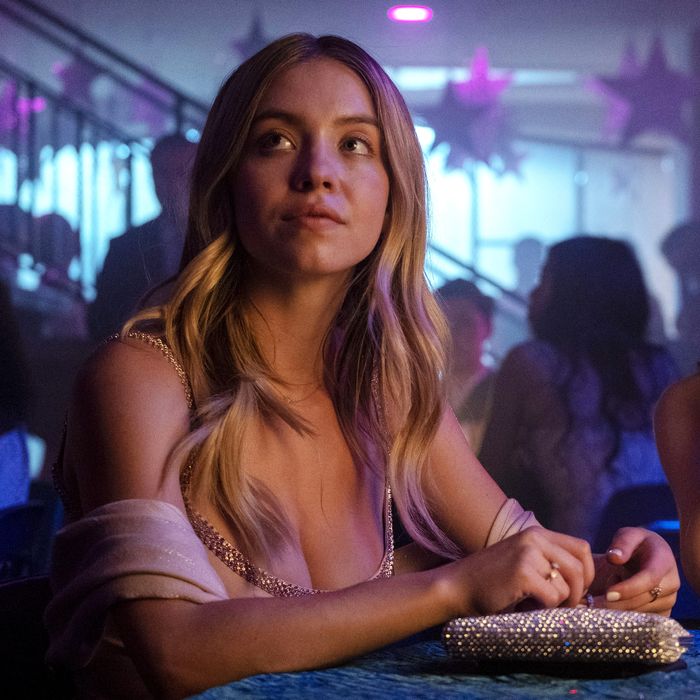
This screenshot has height=700, width=700. I want to click on star decorations, so click(649, 98), click(470, 108), click(484, 74), click(512, 155), click(477, 143), click(148, 96), click(83, 84), click(15, 117).